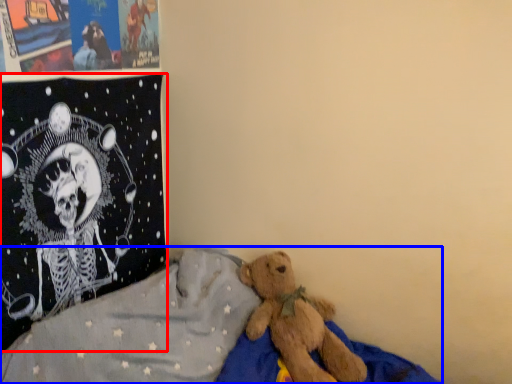
Question: Among these objects, which one is farthest to the camera, pillow (highlighted by a red box) or bed (highlighted by a blue box)?

Choices:
 (A) pillow
 (B) bed

Answer: (A)